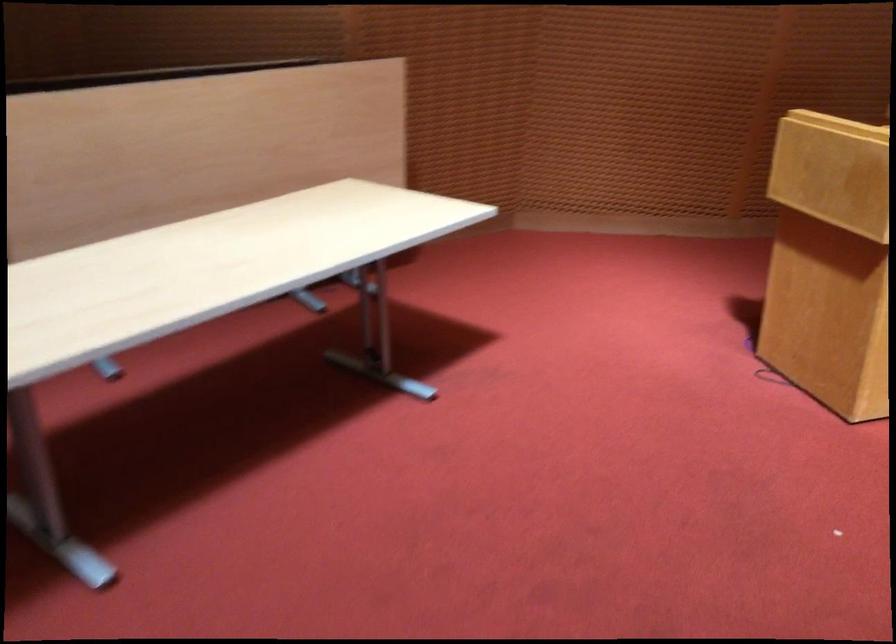
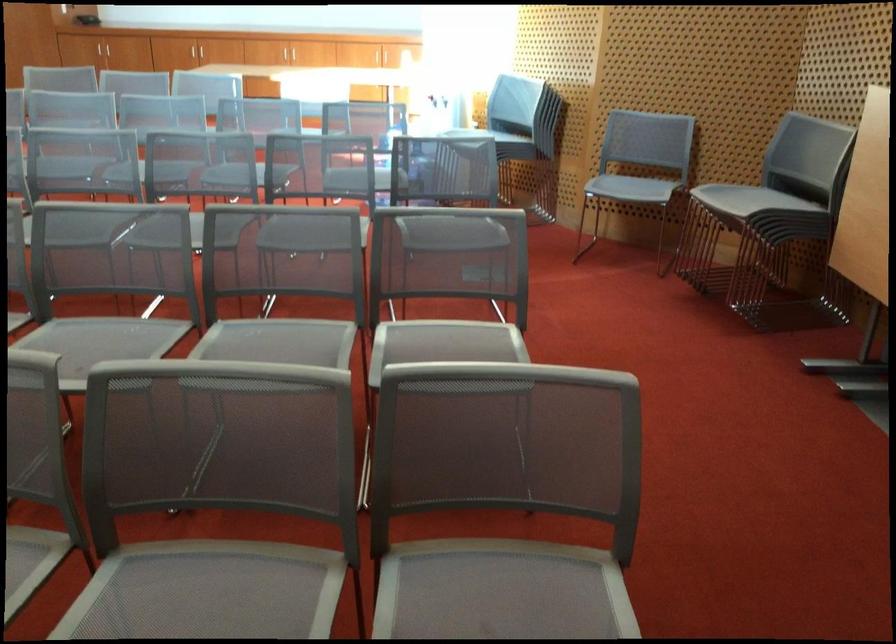
The first image is from the beginning of the video and the second image is from the end. How did the camera likely rotate when shooting the video?

The camera's rotation is toward right-down.